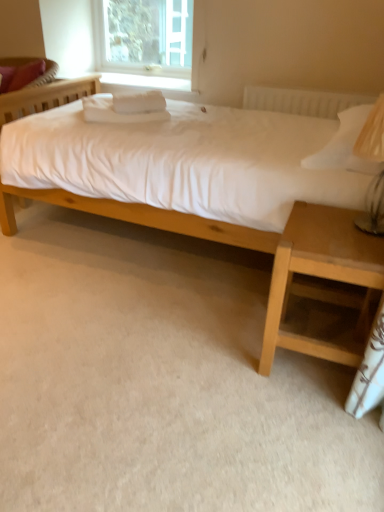
Where is `matte wood bed at center`? matte wood bed at center is located at coordinates (184, 170).

Image resolution: width=384 pixels, height=512 pixels. I want to click on matte pink pillow at upper left, so click(x=20, y=75).

Where is `matte wood bed at center`? matte wood bed at center is located at coordinates (184, 170).

Which is further, (307, 227) or (141, 158)?

The point (141, 158) is behind.

Is matte wood bed at center located within light brown wood nightstand at lower right?

No, matte wood bed at center is not surrounded by light brown wood nightstand at lower right.

Is light brown wood nightstand at lower right aimed at matte wood bed at center?

No, light brown wood nightstand at lower right is not oriented towards matte wood bed at center.

From a real-world perspective, is light brown wood nightstand at lower right above or below matte wood bed at center?

In terms of real-world spatial position, light brown wood nightstand at lower right is below matte wood bed at center.

Are clear glass window at upper center and light brown wood nightstand at lower right far apart?

That's right, there is a large distance between clear glass window at upper center and light brown wood nightstand at lower right.

From the image's perspective, would you say clear glass window at upper center is shown under light brown wood nightstand at lower right?

No, from the image's perspective, clear glass window at upper center is not beneath light brown wood nightstand at lower right.

Can you confirm if clear glass window at upper center is bigger than light brown wood nightstand at lower right?

Actually, clear glass window at upper center might be smaller than light brown wood nightstand at lower right.

Can we say clear glass window at upper center lies outside light brown wood nightstand at lower right?

Yes, clear glass window at upper center is outside of light brown wood nightstand at lower right.

Is matte pink pillow at upper left to the left of light brown wood nightstand at lower right from the viewer's perspective?

Yes.

Who is smaller, matte pink pillow at upper left or light brown wood nightstand at lower right?

Smaller between the two is matte pink pillow at upper left.

Is matte pink pillow at upper left positioned far away from light brown wood nightstand at lower right?

Yes, matte pink pillow at upper left is far from light brown wood nightstand at lower right.

Looking at this image, is matte pink pillow at upper left taller or shorter than light brown wood nightstand at lower right?

matte pink pillow at upper left is shorter than light brown wood nightstand at lower right.

Can you confirm if clear glass window at upper center is shorter than matte wood bed at center?

Indeed, clear glass window at upper center has a lesser height compared to matte wood bed at center.

How different are the orientations of clear glass window at upper center and matte wood bed at center in degrees?

clear glass window at upper center and matte wood bed at center are facing 1.52 degrees away from each other.

Consider the image. From the image's perspective, is clear glass window at upper center on top of matte wood bed at center?

Indeed, from the image's perspective, clear glass window at upper center is shown above matte wood bed at center.

Is clear glass window at upper center behind matte wood bed at center?

Yes, it is behind matte wood bed at center.

Could matte pink pillow at upper left be considered to be inside matte wood bed at center?

No, matte pink pillow at upper left is not surrounded by matte wood bed at center.

From the image's perspective, relative to matte pink pillow at upper left, is matte wood bed at center above or below?

From the image's perspective, matte wood bed at center appears below matte pink pillow at upper left.

Is matte wood bed at center closer to the viewer compared to matte pink pillow at upper left?

Yes, matte wood bed at center is closer to the camera.

Does point (241, 131) appear closer or farther from the camera than point (19, 81)?

Clearly, point (241, 131) is closer to the camera than point (19, 81).

Could you tell me if light brown wood nightstand at lower right is facing clear glass window at upper center?

No, light brown wood nightstand at lower right is not turned towards clear glass window at upper center.

Which of these two, light brown wood nightstand at lower right or clear glass window at upper center, stands taller?

Standing taller between the two is light brown wood nightstand at lower right.

From the image's perspective, which one is positioned lower, light brown wood nightstand at lower right or clear glass window at upper center?

light brown wood nightstand at lower right.

Does point (354, 213) come closer to viewer compared to point (142, 64)?

Yes, point (354, 213) is in front of point (142, 64).

Would you consider matte wood bed at center to be distant from clear glass window at upper center?

matte wood bed at center is positioned a significant distance from clear glass window at upper center.

Is matte wood bed at center taller than clear glass window at upper center?

Yes, matte wood bed at center is taller than clear glass window at upper center.

Can you confirm if matte wood bed at center is smaller than clear glass window at upper center?

Incorrect, matte wood bed at center is not smaller in size than clear glass window at upper center.

Is matte wood bed at center oriented away from clear glass window at upper center?

Yes, matte wood bed at center is positioned with its back facing clear glass window at upper center.

The width and height of the screenshot is (384, 512). I want to click on nightstand below the matte wood bed at center (from the image's perspective), so click(x=319, y=272).

You are a GUI agent. You are given a task and a screenshot of the screen. Output one action in this format:
    pyautogui.click(x=<x>, y=<y>)
    Task: Click on the window that appears on the left of light brown wood nightstand at lower right
    The width and height of the screenshot is (384, 512).
    Given the screenshot: What is the action you would take?
    pyautogui.click(x=143, y=35)

When comparing their distances from clear glass window at upper center, does matte wood bed at center or matte pink pillow at upper left seem further?

matte wood bed at center lies further to clear glass window at upper center than the other object.

Considering their positions, is matte pink pillow at upper left positioned closer to matte wood bed at center than light brown wood nightstand at lower right?

The object closer to matte wood bed at center is light brown wood nightstand at lower right.

Estimate the real-world distances between objects in this image. Which object is further from matte pink pillow at upper left, light brown wood nightstand at lower right or clear glass window at upper center?

The object further to matte pink pillow at upper left is light brown wood nightstand at lower right.

From the picture: When comparing their distances from matte wood bed at center, does matte pink pillow at upper left or clear glass window at upper center seem further?

clear glass window at upper center.

From the picture: Considering their positions, is matte pink pillow at upper left positioned closer to clear glass window at upper center than matte wood bed at center?

matte pink pillow at upper left is positioned closer to the anchor clear glass window at upper center.

When comparing their distances from matte wood bed at center, does light brown wood nightstand at lower right or clear glass window at upper center seem closer?

light brown wood nightstand at lower right is closer to matte wood bed at center.

Consider the image. Looking at the image, which one is located further to light brown wood nightstand at lower right, clear glass window at upper center or matte pink pillow at upper left?

clear glass window at upper center is further to light brown wood nightstand at lower right.

From the image, which object appears to be nearer to matte wood bed at center, clear glass window at upper center or light brown wood nightstand at lower right?

Based on the image, light brown wood nightstand at lower right appears to be nearer to matte wood bed at center.

I want to click on pillow positioned between light brown wood nightstand at lower right and clear glass window at upper center from near to far, so click(20, 75).

Locate an element on the screen. bed between light brown wood nightstand at lower right and matte pink pillow at upper left along the z-axis is located at coordinates 184,170.

You are a GUI agent. You are given a task and a screenshot of the screen. Output one action in this format:
    pyautogui.click(x=<x>, y=<y>)
    Task: Click on the pillow between matte wood bed at center and clear glass window at upper center along the z-axis
    
    Given the screenshot: What is the action you would take?
    pyautogui.click(x=20, y=75)

Where is `bed between light brown wood nightstand at lower right and clear glass window at upper center along the z-axis`? bed between light brown wood nightstand at lower right and clear glass window at upper center along the z-axis is located at coordinates (184, 170).